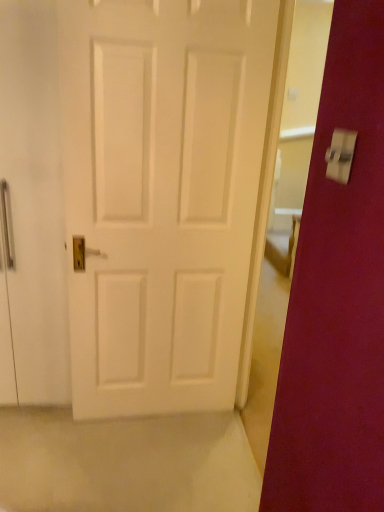
Question: Are metallic silver switch at upper right and white matte door at center beside each other?

Choices:
 (A) yes
 (B) no

Answer: (B)

Question: Are metallic silver switch at upper right and white matte door at center located far from each other?

Choices:
 (A) yes
 (B) no

Answer: (A)

Question: Does metallic silver switch at upper right have a greater width compared to white matte door at center?

Choices:
 (A) yes
 (B) no

Answer: (B)

Question: Is metallic silver switch at upper right positioned behind white matte door at center?

Choices:
 (A) yes
 (B) no

Answer: (B)

Question: Is metallic silver switch at upper right outside white matte door at center?

Choices:
 (A) no
 (B) yes

Answer: (B)

Question: From the image's perspective, is metallic silver switch at upper right under white matte door at center?

Choices:
 (A) no
 (B) yes

Answer: (A)

Question: Is white matte door at center positioned before metallic silver switch at upper right?

Choices:
 (A) no
 (B) yes

Answer: (A)

Question: Can you confirm if white matte door at center is smaller than metallic silver switch at upper right?

Choices:
 (A) yes
 (B) no

Answer: (B)

Question: Can you confirm if white matte door at center is positioned to the left of metallic silver switch at upper right?

Choices:
 (A) no
 (B) yes

Answer: (B)

Question: Can you confirm if white matte door at center is wider than metallic silver switch at upper right?

Choices:
 (A) no
 (B) yes

Answer: (B)

Question: From the image's perspective, is white matte door at center above metallic silver switch at upper right?

Choices:
 (A) yes
 (B) no

Answer: (B)

Question: Does white matte door at center have a lesser width compared to metallic silver switch at upper right?

Choices:
 (A) no
 (B) yes

Answer: (A)

Question: Is point (344, 147) closer or farther from the camera than point (147, 282)?

Choices:
 (A) farther
 (B) closer

Answer: (B)